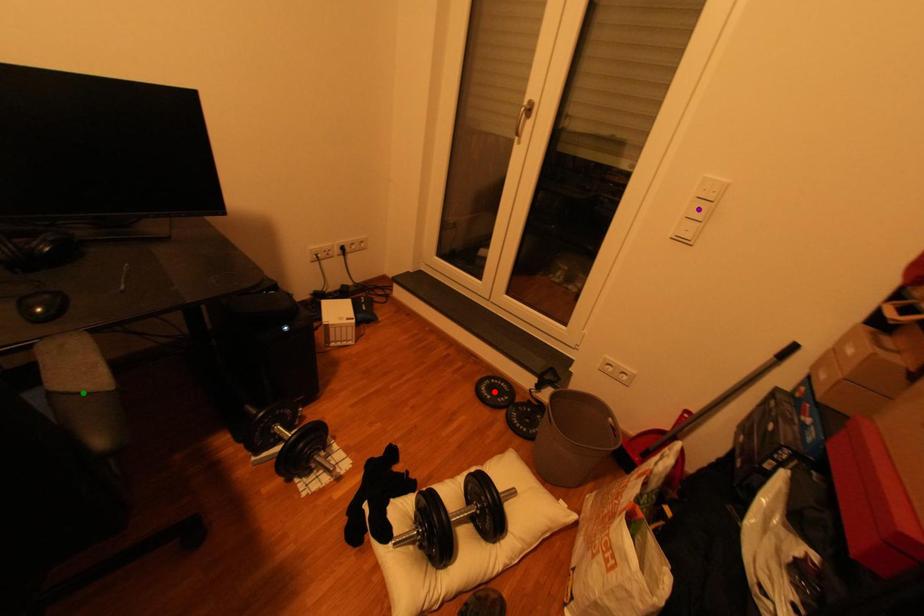
Order these from nearest to farthest:
purple point | red point | green point

red point
purple point
green point